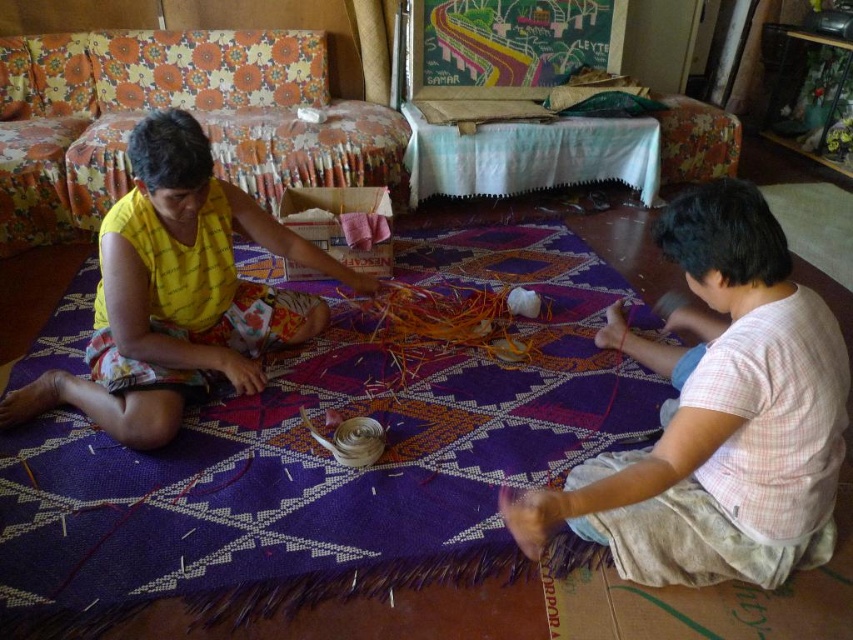
Question: Can you confirm if light pink plaid shirt at right is smaller than yellow printed fabric at left?

Choices:
 (A) no
 (B) yes

Answer: (A)

Question: Is the position of light pink plaid shirt at right less distant than that of yellow printed fabric at left?

Choices:
 (A) no
 (B) yes

Answer: (B)

Question: Among these points, which one is farthest from the camera?

Choices:
 (A) (120, 202)
 (B) (610, 545)

Answer: (A)

Question: Observing the image, what is the correct spatial positioning of light pink plaid shirt at right in reference to yellow printed fabric at left?

Choices:
 (A) below
 (B) above

Answer: (A)

Question: Which of the following is the farthest from the observer?

Choices:
 (A) light pink plaid shirt at right
 (B) yellow printed fabric at left

Answer: (B)